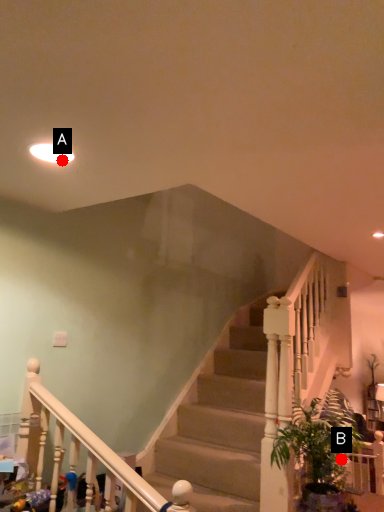
Question: Two points are circled on the image, labeled by A and B beside each circle. Which point is farther from the camera taking this photo?

Choices:
 (A) A is further
 (B) B is further

Answer: (B)